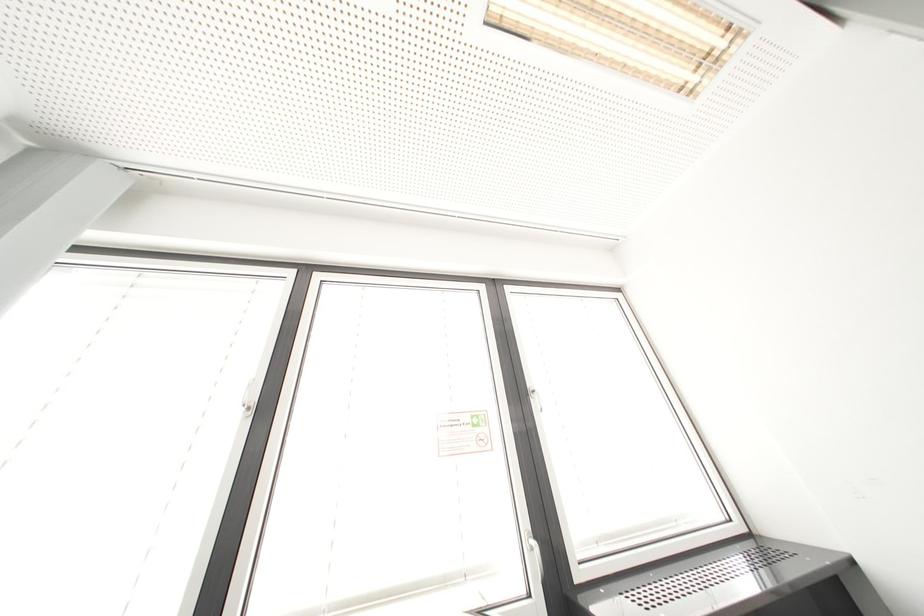
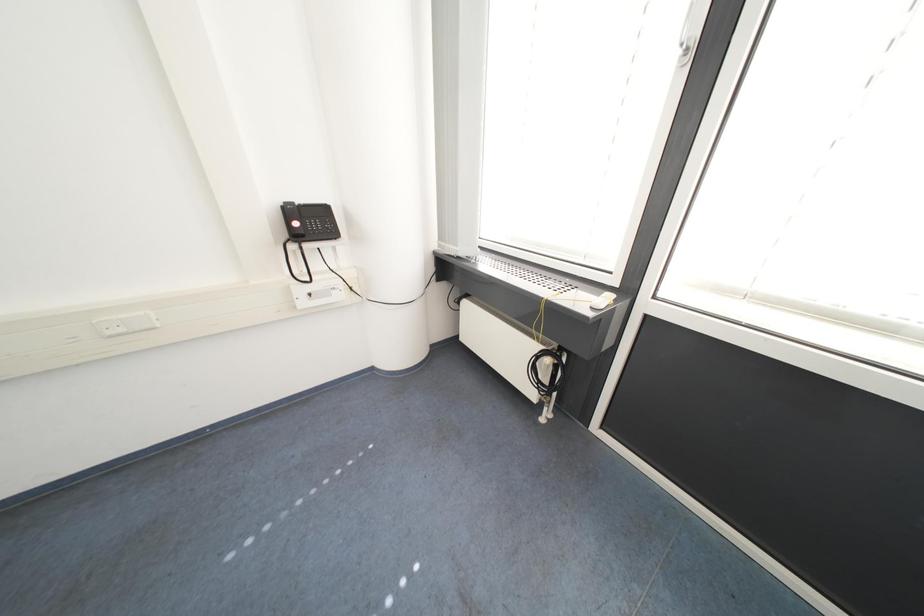
Based on the continuous images, in which direction is the camera rotating?

The camera's rotation is toward left-down.